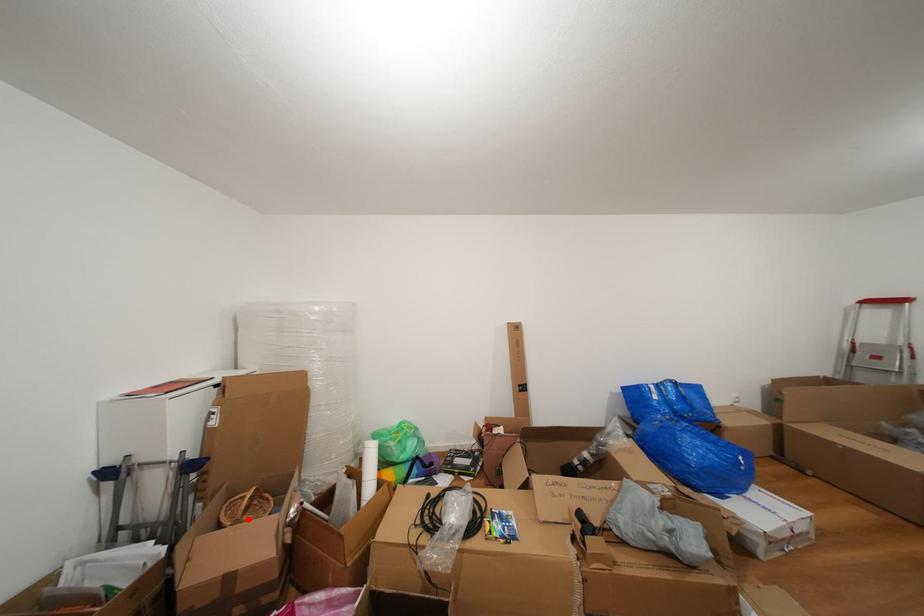
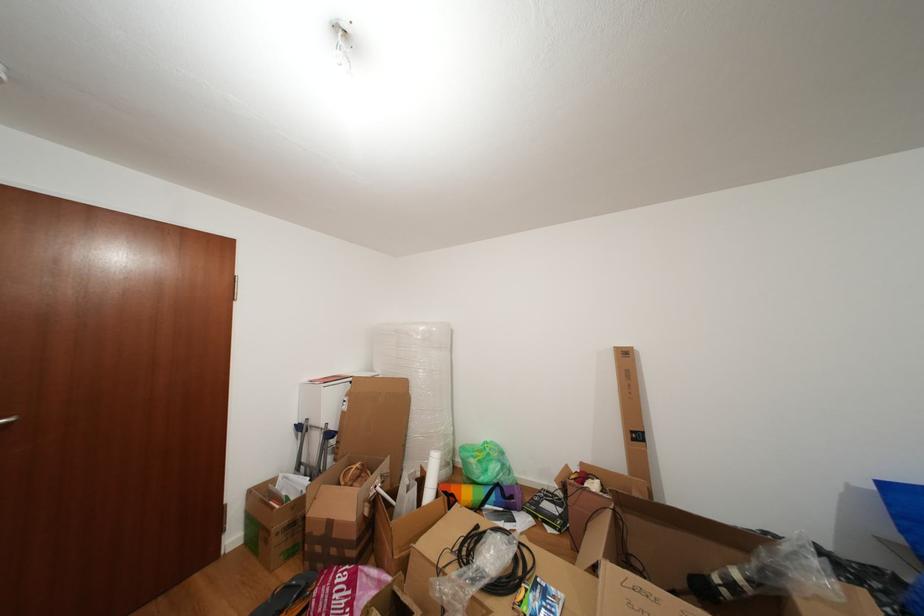
Question: I am providing you with two images of the same scene from different viewpoints. In image1, a red point is highlighted. Considering the same 3D point in image2, which of the following is correct?

Choices:
 (A) It is closer
 (B) It is farther

Answer: (B)